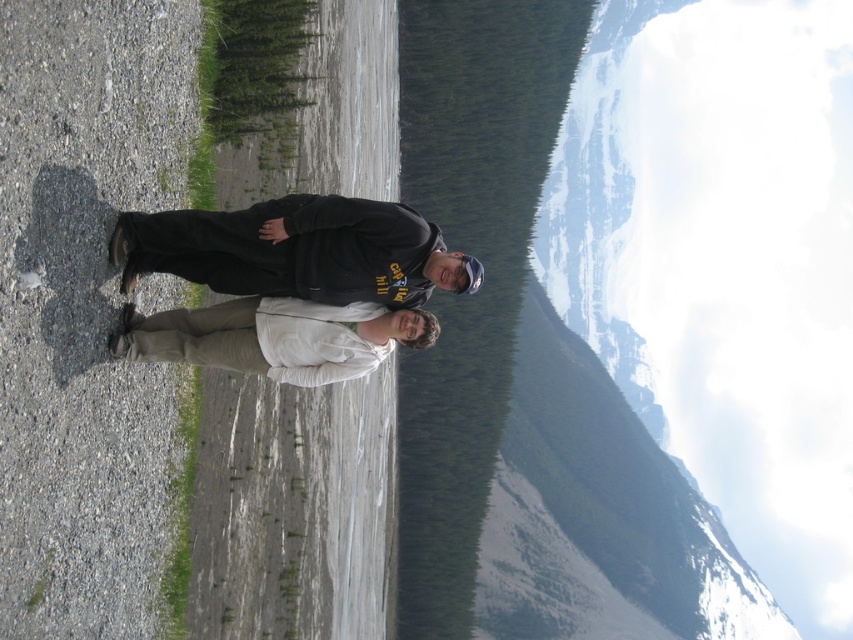
Is black matte hoodie at center taller than white matte jacket at center?

Yes, black matte hoodie at center is taller than white matte jacket at center.

Is black matte hoodie at center above white matte jacket at center?

Yes, black matte hoodie at center is above white matte jacket at center.

Does point (239, 214) come behind point (267, 362)?

No, it is not.

Find the location of a particular element. The height and width of the screenshot is (640, 853). black matte hoodie at center is located at coordinates (300, 250).